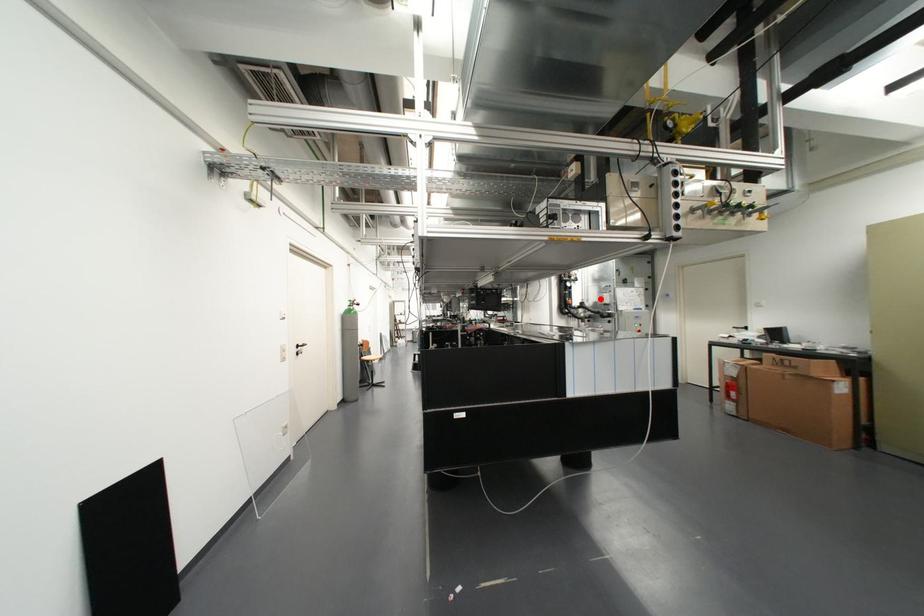
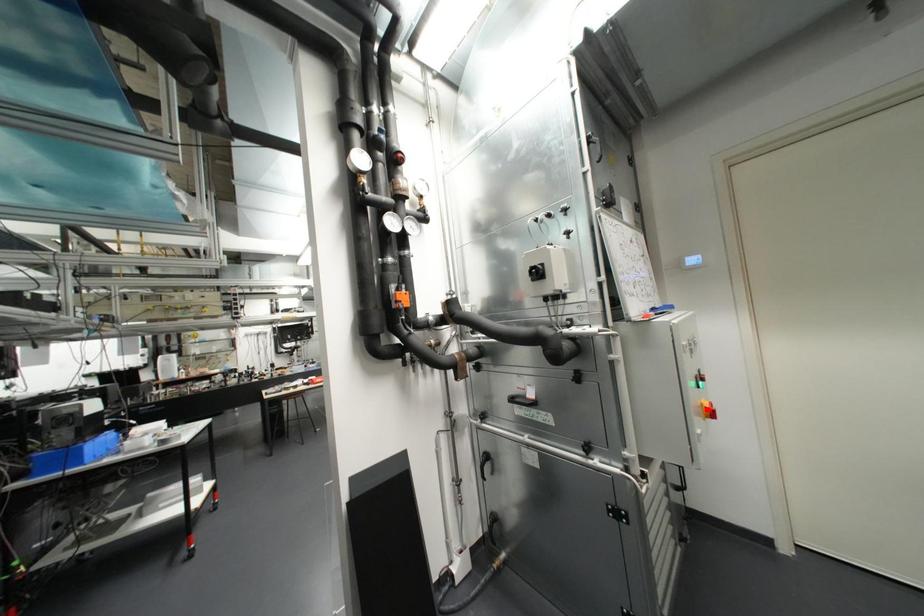
I am providing you with two images of the same scene from different viewpoints. A red point is marked on the first image and another point is marked on the second image. Do the highlighted points in image1 and image2 indicate the same real-world spot?

No